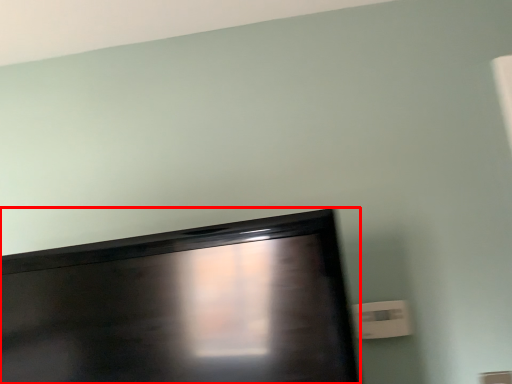
Question: From the image, what is the correct spatial relationship of television (annotated by the red box) in relation to electric outlet?

Choices:
 (A) right
 (B) left

Answer: (B)